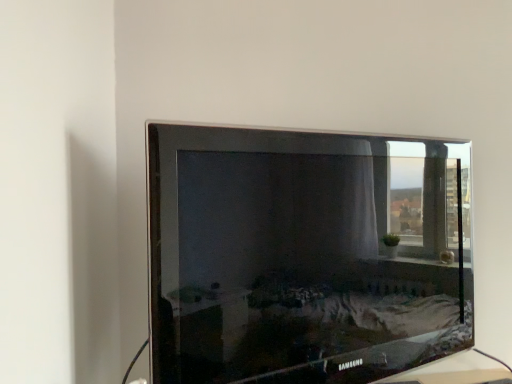
The image size is (512, 384). Describe the element at coordinates (304, 255) in the screenshot. I see `satin silver television at center` at that location.

In order to click on satin silver television at center in this screenshot , I will do `click(304, 255)`.

Locate an element on the screen. satin silver television at center is located at coordinates (304, 255).